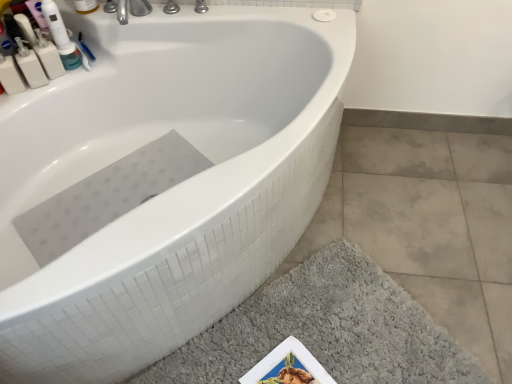
Locate an element on the screen. The image size is (512, 384). blank space situated above gray shaggy bath mat at lower right (from a real-world perspective) is located at coordinates (307, 334).